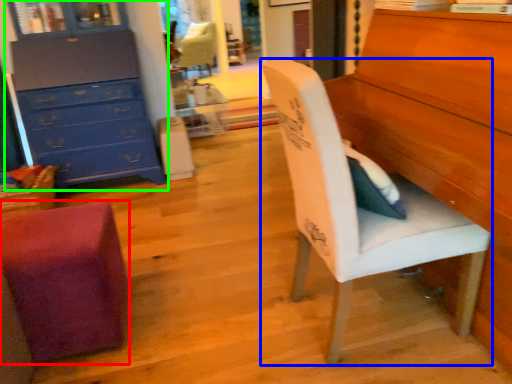
Question: Which object is the closest to the chair (highlighted by a red box)? Choose among these: chair (highlighted by a blue box) or chest of drawers (highlighted by a green box).

Choices:
 (A) chair
 (B) chest of drawers

Answer: (A)